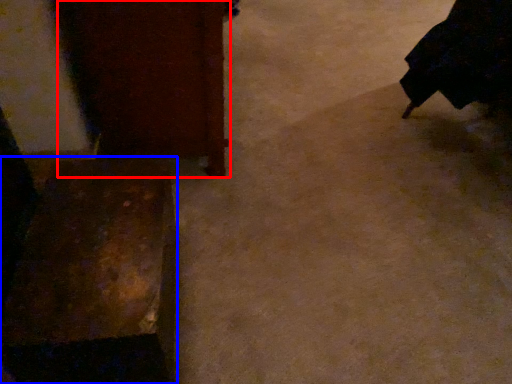
Question: Which object appears closest to the camera in this image, furniture (highlighted by a red box) or furniture (highlighted by a blue box)?

Choices:
 (A) furniture
 (B) furniture

Answer: (B)